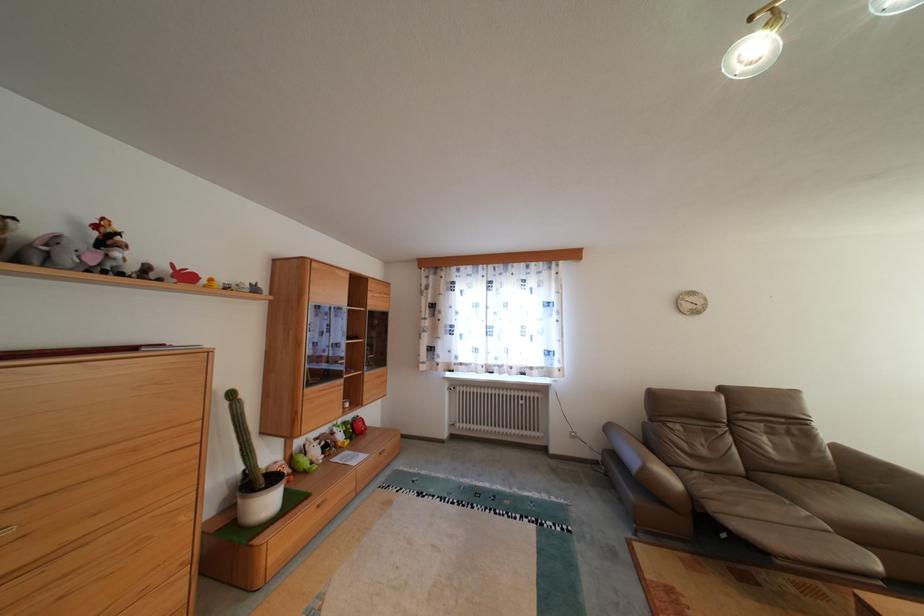
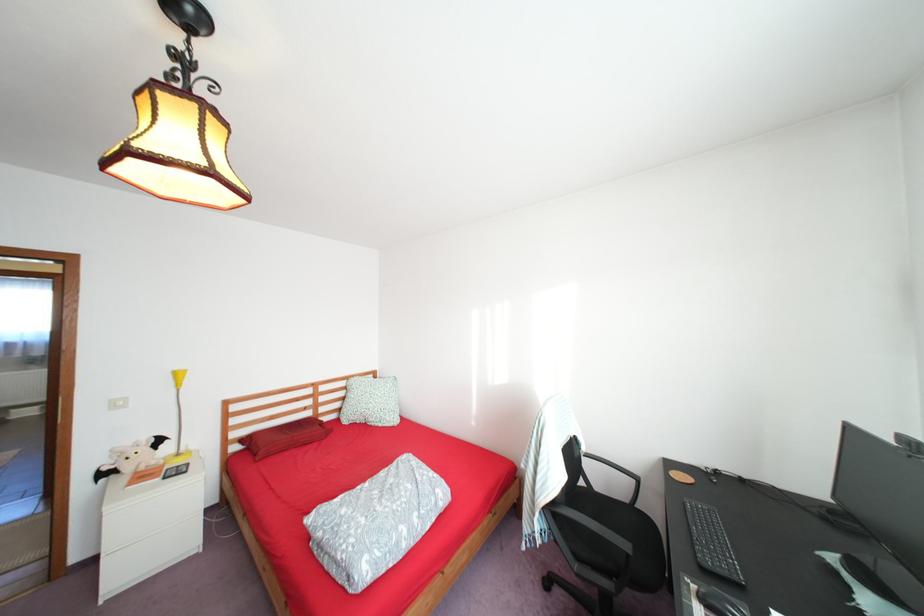
Question: I am providing you with two images of the same scene from different viewpoints. After the viewpoint changes to image2, which objects are now occluded?

Choices:
 (A) red rectangular pillow
 (B) patterned square pillow
 (C) woven laundry basket
 (D) white plant pot

Answer: (D)